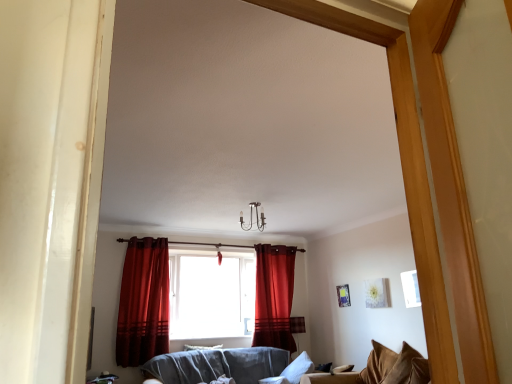
Question: Is velvet red curtain at center, which is the 2th curtain in left-to-right order, positioned beyond the bounds of velvet brown pillow at lower right, acting as the 1th pillow starting from the right?

Choices:
 (A) no
 (B) yes

Answer: (B)

Question: Can you confirm if velvet red curtain at center, which is counted as the 2th curtain, starting from the front, is wider than velvet brown pillow at lower right, the 2th pillow positioned from the left?

Choices:
 (A) no
 (B) yes

Answer: (A)

Question: Considering the relative sizes of velvet red curtain at center, which appears as the first curtain when viewed from the right, and velvet brown pillow at lower right, arranged as the 2th pillow when viewed from the back, in the image provided, is velvet red curtain at center, which appears as the first curtain when viewed from the right, smaller than velvet brown pillow at lower right, arranged as the 2th pillow when viewed from the back,?

Choices:
 (A) yes
 (B) no

Answer: (B)

Question: Considering the relative sizes of velvet red curtain at center, which is counted as the 2th curtain, starting from the front, and velvet brown pillow at lower right, which is the 1th pillow from top to bottom, in the image provided, is velvet red curtain at center, which is counted as the 2th curtain, starting from the front, thinner than velvet brown pillow at lower right, which is the 1th pillow from top to bottom,?

Choices:
 (A) yes
 (B) no

Answer: (A)

Question: From a real-world perspective, is velvet red curtain at center, which is the 2th curtain in left-to-right order, located beneath velvet brown pillow at lower right, which is the 1th pillow from top to bottom?

Choices:
 (A) yes
 (B) no

Answer: (B)

Question: From a real-world perspective, is velvet brown couch at lower right positioned above or below white soft pillow at lower center, arranged as the first pillow when viewed from the back?

Choices:
 (A) above
 (B) below

Answer: (B)

Question: In terms of size, does velvet brown couch at lower right appear bigger or smaller than white soft pillow at lower center, which is the 2th pillow in front-to-back order?

Choices:
 (A) small
 (B) big

Answer: (B)

Question: Is velvet brown couch at lower right spatially inside white soft pillow at lower center, which is the 2th pillow in front-to-back order, or outside of it?

Choices:
 (A) inside
 (B) outside

Answer: (B)

Question: From the image's perspective, relative to white soft pillow at lower center, positioned as the 2th pillow in right-to-left order, is velvet brown couch at lower right above or below?

Choices:
 (A) above
 (B) below

Answer: (A)

Question: Choose the correct answer: Is velvet brown couch at lower right inside velvet red curtain at center, which is the 2th curtain in left-to-right order, or outside it?

Choices:
 (A) inside
 (B) outside

Answer: (B)

Question: Based on their sizes in the image, would you say velvet brown couch at lower right is bigger or smaller than velvet red curtain at center, which is counted as the 2th curtain, starting from the front?

Choices:
 (A) small
 (B) big

Answer: (B)

Question: Considering the positions of velvet brown couch at lower right and velvet red curtain at center, which is the 2th curtain in left-to-right order, in the image, is velvet brown couch at lower right taller or shorter than velvet red curtain at center, which is the 2th curtain in left-to-right order,?

Choices:
 (A) short
 (B) tall

Answer: (A)

Question: Is velvet brown couch at lower right wider or thinner than velvet red curtain at center, the first curtain when ordered from back to front?

Choices:
 (A) thin
 (B) wide

Answer: (B)

Question: From a real-world perspective, is velvet brown couch at lower right physically located above or below velvet brown pillow at lower right, the 2th pillow ordered from the bottom?

Choices:
 (A) above
 (B) below

Answer: (A)

Question: In the image, is velvet brown couch at lower right positioned in front of or behind velvet brown pillow at lower right, arranged as the 2th pillow when viewed from the back?

Choices:
 (A) front
 (B) behind

Answer: (A)